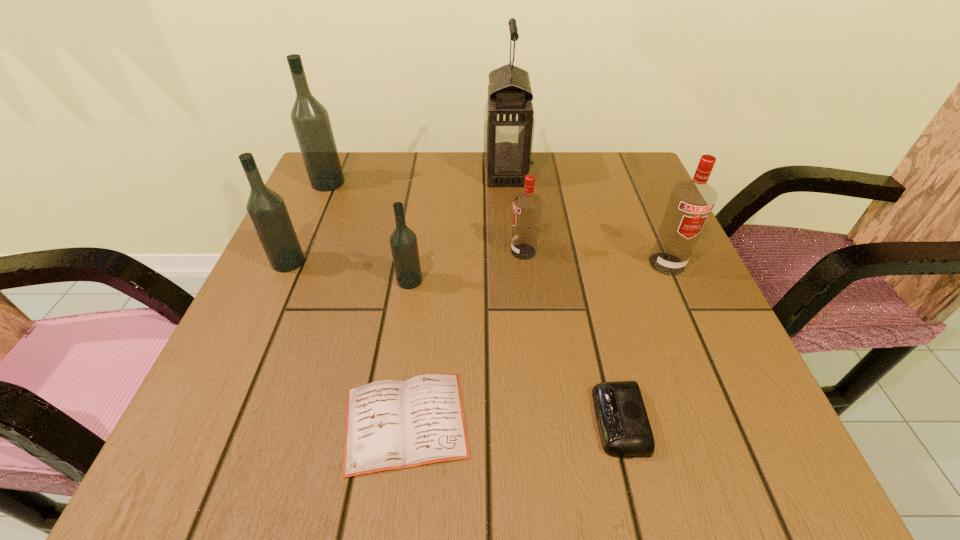
Identify the location of alarm clock. The height and width of the screenshot is (540, 960). (623, 424).

This screenshot has height=540, width=960. Find the location of `the seventh tallest object`. the seventh tallest object is located at coordinates (623, 424).

Find the location of `diary`. diary is located at coordinates (390, 424).

Where is `the shortest object`? the shortest object is located at coordinates (390, 424).

Where is `vacant region located on the front-facing side of the gray lantern`? The image size is (960, 540). vacant region located on the front-facing side of the gray lantern is located at coordinates (367, 173).

The image size is (960, 540). I want to click on vacant space located on the front-facing side of the gray lantern, so click(x=441, y=173).

In order to click on vacant area situated on the front-facing side of the gray lantern in this screenshot , I will do `click(401, 173)`.

Find the location of a particular element. The height and width of the screenshot is (540, 960). free space located 0.130m on the front of the biggest black vodka is located at coordinates (309, 225).

At what (x,y) coordinates should I click in order to perform the action: click on free location located on the back of the second smallest black vodka. Please return your answer as a coordinate pair (x, y). Looking at the image, I should click on (320, 191).

Locate an element on the screen. The width and height of the screenshot is (960, 540). vacant position located on the front label of the rightmost object is located at coordinates (687, 312).